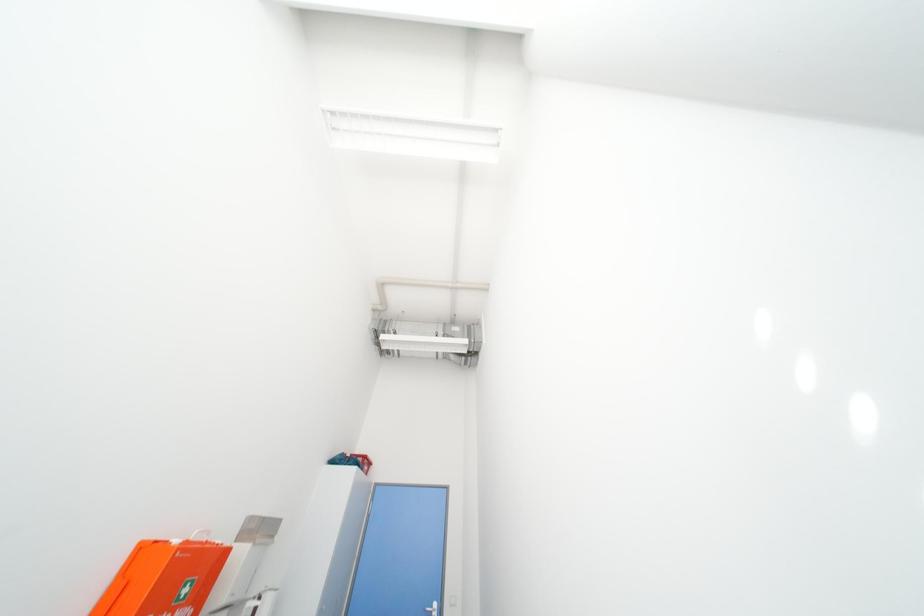
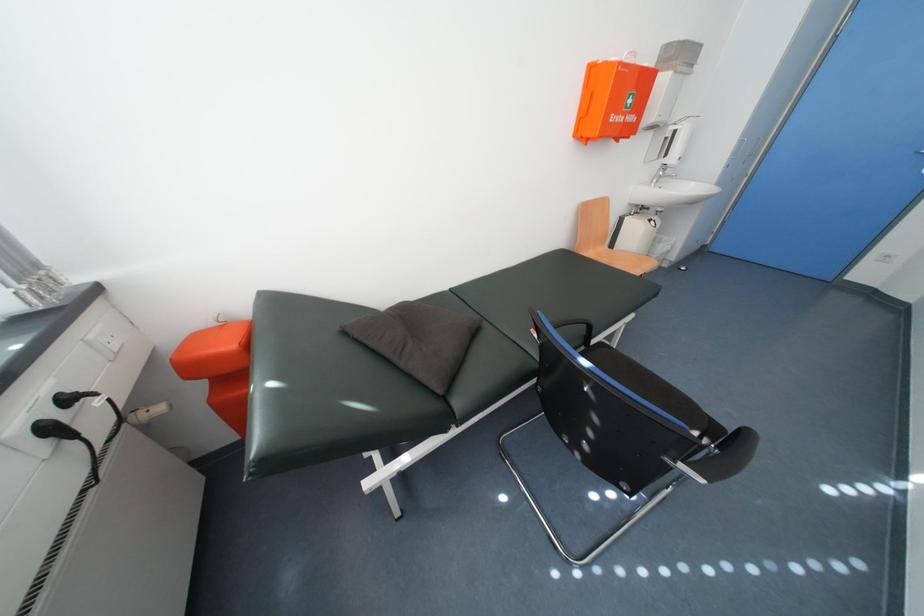
First-person continuous shooting, in which direction is the camera rotating?

The camera's rotation is toward left-down.